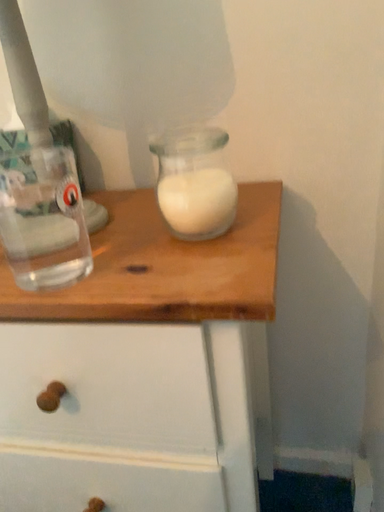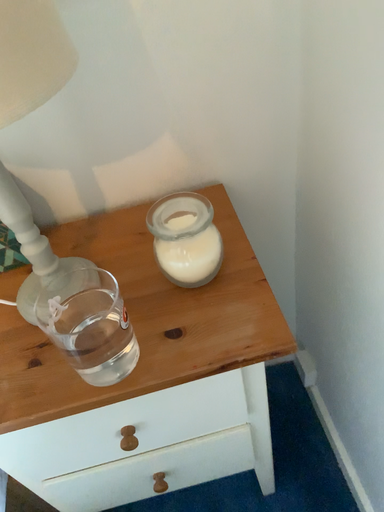
Question: How did the camera likely rotate when shooting the video?

Choices:
 (A) rotated upward
 (B) rotated downward

Answer: (B)